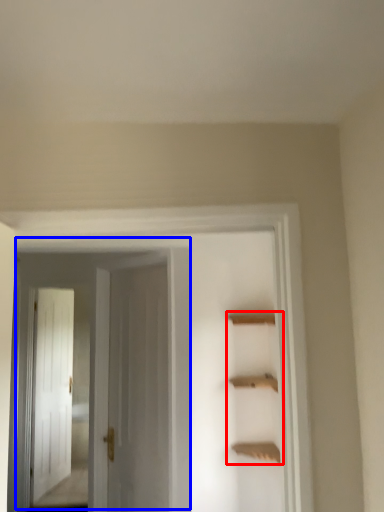
Question: Which object is closer to the camera taking this photo, cabinet (highlighted by a red box) or door (highlighted by a blue box)?

Choices:
 (A) cabinet
 (B) door

Answer: (B)